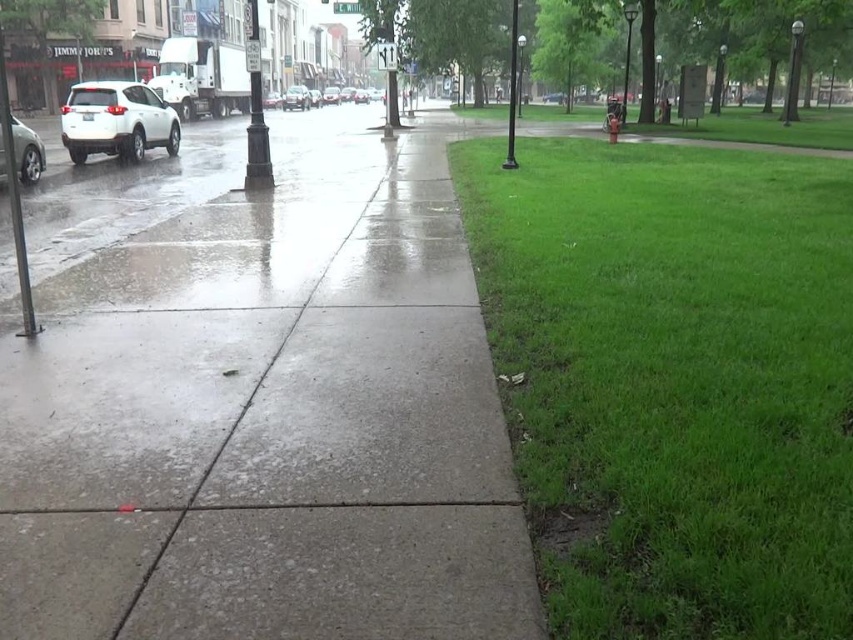
Question: Which of these objects is positioned closest to the white matte car at center?

Choices:
 (A) silver metallic sedan at left
 (B) green grass at right
 (C) concrete sidewalk at center
 (D) shiny silver sedan at center

Answer: (D)

Question: Is silver metallic sedan at left bigger than white matte car at center?

Choices:
 (A) no
 (B) yes

Answer: (B)

Question: Can you confirm if green grass at right is positioned above shiny silver sedan at center?

Choices:
 (A) yes
 (B) no

Answer: (B)

Question: Does shiny silver sedan at center have a lesser width compared to white matte car at center?

Choices:
 (A) yes
 (B) no

Answer: (B)

Question: Which of the following is the closest to the observer?

Choices:
 (A) (296, 173)
 (B) (3, 148)
 (C) (83, 148)

Answer: (B)

Question: Which of these objects is positioned farthest from the white matte suv at left?

Choices:
 (A) green grass at right
 (B) shiny silver sedan at center

Answer: (B)